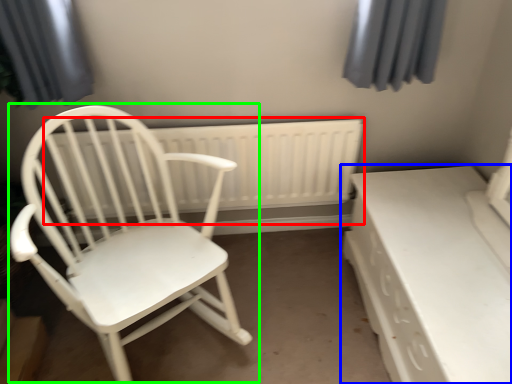
Question: Based on their relative distances, which object is farther from radiator (highlighted by a red box)? Choose from table (highlighted by a blue box) and chair (highlighted by a green box).

Choices:
 (A) table
 (B) chair

Answer: (A)